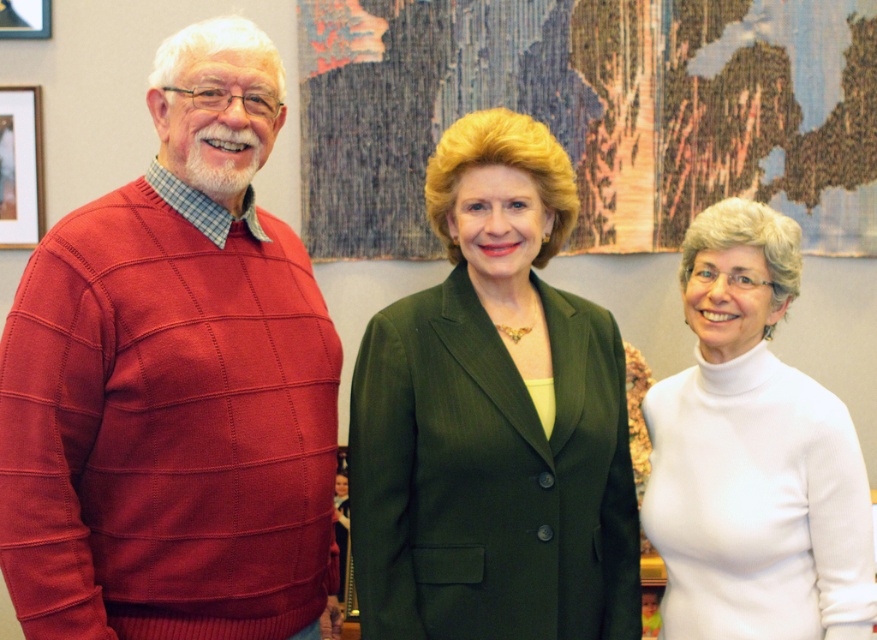
You are a photographer setting up for a group photo. You need to ensure that the green pinstripe suit at center and the wooden picture frame at left are both visible in the shot. Considering their heights, which object might you need to adjust the camera angle to accommodate?

The green pinstripe suit at center is taller than the wooden picture frame at left, so you might need to adjust the camera angle to ensure the taller green pinstripe suit at center doesn not block the view of the shorter wooden picture frame at left.

You are a photographer taking a group photo and need to ensure that the white turtleneck sweater at center and the wooden picture frame at left are both visible in the shot. Based on their positions, which object is closer to the camera?

The white turtleneck sweater at center is in front of the wooden picture frame at left, so it is closer to the camera.

You are organizing a photo shoot and need to arrange the green pinstripe suit at center and the wooden picture frame at left in a way that follows the original image. Which object should be placed to the right of the other?

The green pinstripe suit at center is positioned on the right side of wooden picture frame at left, so the green pinstripe suit at center should be placed to the right of the wooden picture frame at left.